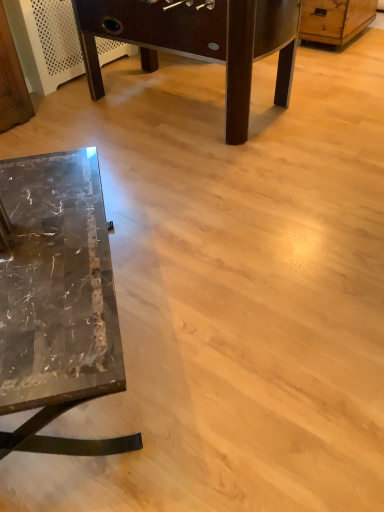
What are the coordinates of `vacant space behind marble table at lower left, which appears as the 1th table when viewed from the front` in the screenshot? It's located at point(158,204).